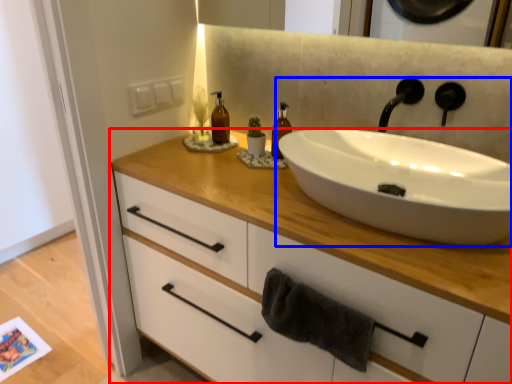
Question: Which of the following is the closest to the observer, bathroom cabinet (highlighted by a red box) or sink (highlighted by a blue box)?

Choices:
 (A) bathroom cabinet
 (B) sink

Answer: (A)